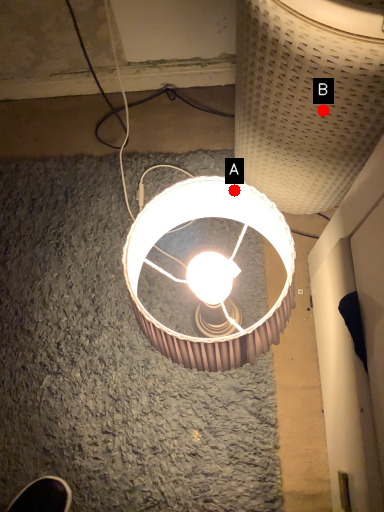
Question: Two points are circled on the image, labeled by A and B beside each circle. Which point is farther from the camera taking this photo?

Choices:
 (A) A is further
 (B) B is further

Answer: (B)